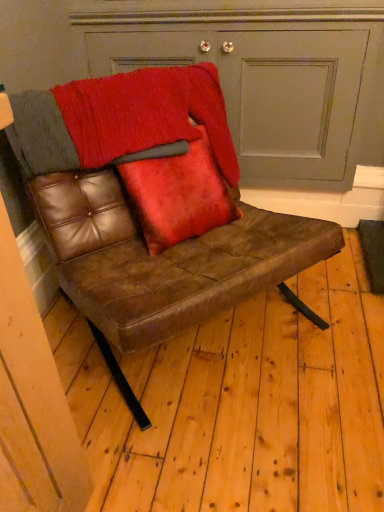
Question: Is matte gray door at upper center wider or thinner than brown leather chair at center?

Choices:
 (A) wide
 (B) thin

Answer: (B)

Question: Do you think matte gray door at upper center is within brown leather chair at center, or outside of it?

Choices:
 (A) inside
 (B) outside

Answer: (B)

Question: Which object is the farthest from the brown leather chair at center?

Choices:
 (A) textured wool blanket at upper center
 (B) velvet red pillow at center
 (C) matte gray door at upper center

Answer: (C)

Question: Which object is the farthest from the brown leather chair at center?

Choices:
 (A) matte gray door at upper center
 (B) velvet red pillow at center
 (C) textured wool blanket at upper center

Answer: (A)